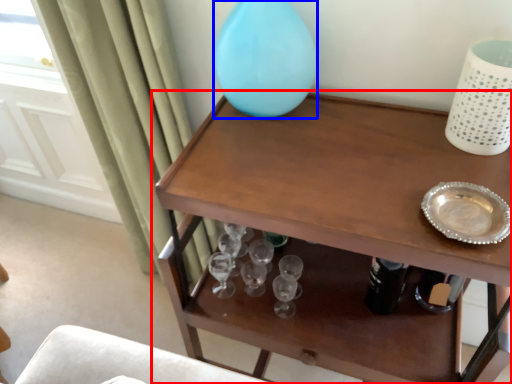
Question: Which point is further to the camera, table (highlighted by a red box) or vase (highlighted by a blue box)?

Choices:
 (A) table
 (B) vase

Answer: (B)